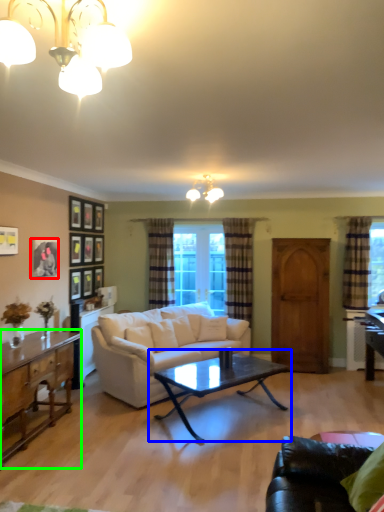
Question: Which is farther away from picture frame (highlighted by a red box)? coffee table (highlighted by a blue box) or cabinetry (highlighted by a green box)?

Choices:
 (A) coffee table
 (B) cabinetry

Answer: (A)